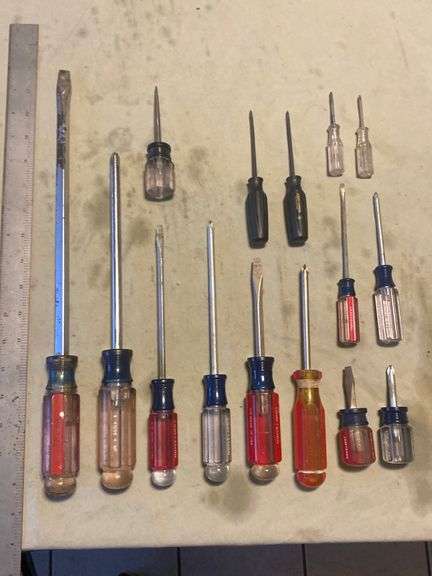
Image resolution: width=432 pixels, height=576 pixels. In order to click on table with tools in this screenshot , I will do `click(187, 109)`.